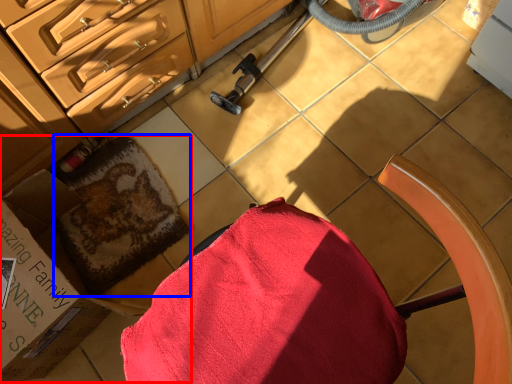
Question: Which object appears closest to the camera in this image, box (highlighted by a red box) or bath towel (highlighted by a blue box)?

Choices:
 (A) box
 (B) bath towel

Answer: (A)